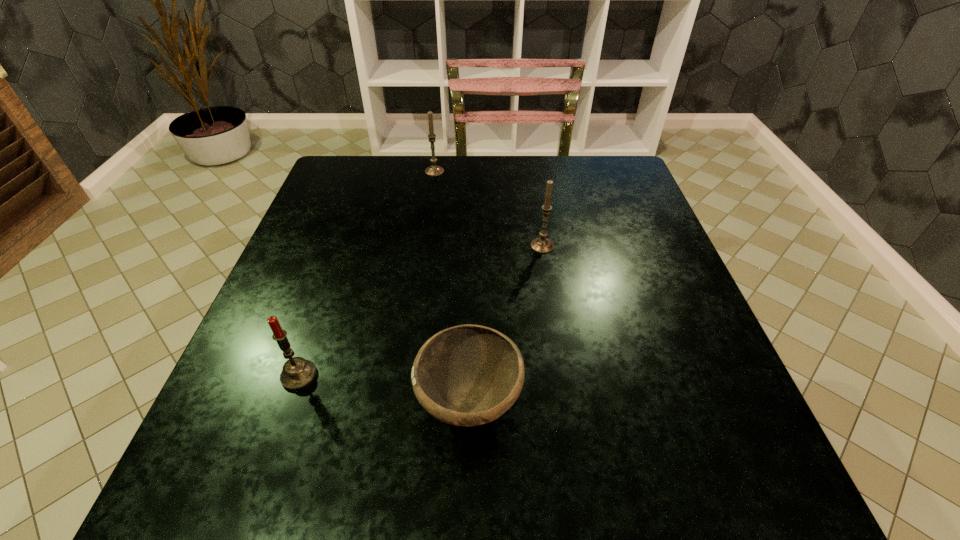
This screenshot has height=540, width=960. In order to click on vacant space positioned on the right of the bowl in this screenshot , I will do `click(691, 401)`.

Identify the location of object situated at the far edge. (434, 170).

Locate an element on the screen. object that is at the near edge is located at coordinates (467, 375).

Locate an element on the screen. object positioned at the left edge is located at coordinates (298, 373).

Locate an element on the screen. This screenshot has height=540, width=960. vacant space at the near edge of the desktop is located at coordinates (612, 476).

In the image, there is a desktop. Where is `vacant space at the left edge`? The image size is (960, 540). vacant space at the left edge is located at coordinates (335, 301).

In the image, there is a desktop. Where is `vacant space at the right edge`? This screenshot has height=540, width=960. vacant space at the right edge is located at coordinates (718, 413).

Image resolution: width=960 pixels, height=540 pixels. I want to click on vacant space at the far left corner, so click(x=337, y=161).

Where is `free space at the near left corner`? free space at the near left corner is located at coordinates (216, 455).

In the image, there is a desktop. At what (x,y) coordinates should I click in order to perform the action: click on free space at the far right corner. Please return your answer as a coordinate pair (x, y). Looking at the image, I should click on (626, 158).